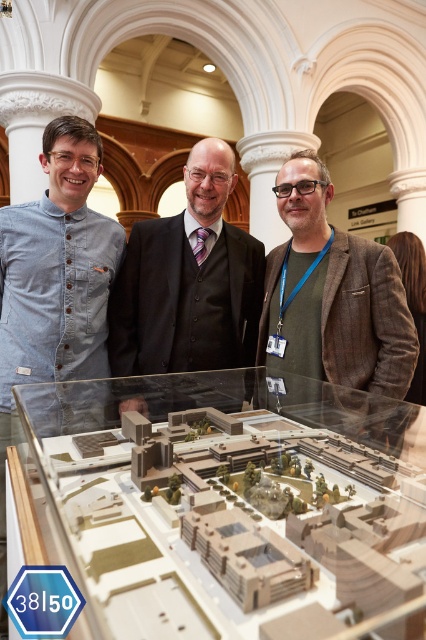
You are standing in front of the glass display case with the architectural model. You need to locate the brown tweed blazer at center. Based on the coordinates provided, where exactly should you look to find it?

The brown tweed blazer at center is located at coordinates point (333, 300), so you should look towards the central area slightly to the right and lower middle section of the display case.

You are observing a group of people discussing an architectural model. You notice two individuals wearing brown suits at the center of the scene. Which one is wearing the brown tweed blazer at center located to the right of the brown textured suit at center?

The brown tweed blazer at center is positioned on the right side of the brown textured suit at center, so the person wearing the brown tweed blazer at center is to the right of the individual in the brown textured suit at center.

You are standing in front of the glass display case with the architectural model. There are two points marked on the model at coordinates point (408, 339) and point (176, 364). Which point is closer to you?

Point (408, 339) is closer to the viewer than point (176, 364).